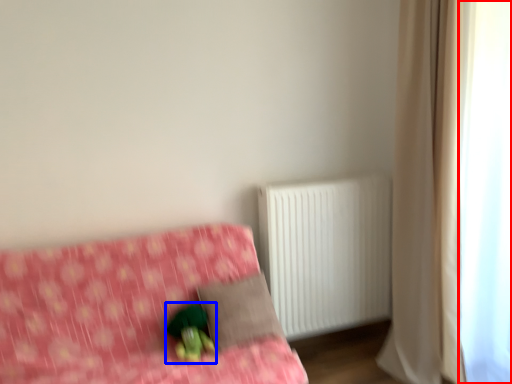
Question: Which object is closer to the camera taking this photo, window screen (highlighted by a red box) or figurine (highlighted by a blue box)?

Choices:
 (A) window screen
 (B) figurine

Answer: (A)